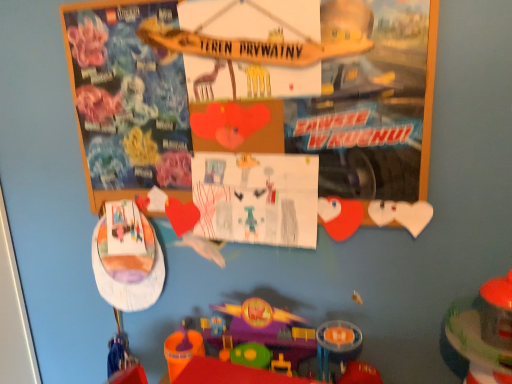
You are a GUI agent. You are given a task and a screenshot of the screen. Output one action in this format:
    pyautogui.click(x=<x>, y=<y>)
    Task: Click on the translucent plastic toy at lower right, which is the first toy in right-to-left order
    
    Given the screenshot: What is the action you would take?
    pyautogui.click(x=484, y=332)

What is the approximate width of colored paper drawing at center?

1.17 inches.

What do you see at coordinates (127, 281) in the screenshot?
I see `matte plastic plate at left, placed as the first toy when sorted from left to right` at bounding box center [127, 281].

Identify the location of wooden sign at upper center. (342, 113).

Locate an element on the screen. The height and width of the screenshot is (384, 512). translucent plastic toy at lower right, which is the first toy in right-to-left order is located at coordinates (484, 332).

From the image's perspective, does colored paper drawing at center appear lower than matte plastic plate at left, placed as the first toy when sorted from left to right?

Incorrect, from the image's perspective, colored paper drawing at center is higher than matte plastic plate at left, placed as the first toy when sorted from left to right.

Locate an element on the screen. poster page above the matte plastic plate at left, the 3th toy positioned from the right (from the image's perspective) is located at coordinates (257, 198).

Is colored paper drawing at center at the left side of matte plastic plate at left, the 3th toy positioned from the right?

No.

From a real-world perspective, who is located higher, colored paper drawing at center or matte plastic plate at left, the 3th toy positioned from the right?

In real-world perspective, colored paper drawing at center is above.

Is wooden sign at upper center situated inside colored paper drawing at center or outside?

wooden sign at upper center is outside colored paper drawing at center.

From a real-world perspective, is wooden sign at upper center above or below colored paper drawing at center?

wooden sign at upper center is situated higher than colored paper drawing at center in the real world.

Is wooden sign at upper center with colored paper drawing at center?

No, wooden sign at upper center is not making contact with colored paper drawing at center.

Considering the relative positions of colored paper drawing at center and translucent plastic toy at lower right, placed as the third toy when sorted from left to right, in the image provided, is colored paper drawing at center to the left of translucent plastic toy at lower right, placed as the third toy when sorted from left to right, from the viewer's perspective?

Yes.

Considering the sizes of colored paper drawing at center and translucent plastic toy at lower right, which is the first toy in right-to-left order, in the image, is colored paper drawing at center bigger or smaller than translucent plastic toy at lower right, which is the first toy in right-to-left order,?

In the image, colored paper drawing at center appears to be smaller than translucent plastic toy at lower right, which is the first toy in right-to-left order.

Is colored paper drawing at center thinner than translucent plastic toy at lower right, placed as the third toy when sorted from left to right?

Correct, the width of colored paper drawing at center is less than that of translucent plastic toy at lower right, placed as the third toy when sorted from left to right.

Identify the location of poster page behind the translucent plastic toy at lower right, placed as the third toy when sorted from left to right. The height and width of the screenshot is (384, 512). (257, 198).

From a real-world perspective, which object rests below the other?

From a 3D spatial view, plastic toy train at center, the 2th toy in the right-to-left sequence, is below.

Is colored paper drawing at center next to plastic toy train at center, the 2th toy in the left-to-right sequence?

No, colored paper drawing at center is not beside plastic toy train at center, the 2th toy in the left-to-right sequence.

Is colored paper drawing at center oriented towards plastic toy train at center, the 2th toy in the left-to-right sequence?

No, colored paper drawing at center is not oriented towards plastic toy train at center, the 2th toy in the left-to-right sequence.

From the image's perspective, between colored paper drawing at center and plastic toy train at center, the 2th toy in the left-to-right sequence, who is located below?

plastic toy train at center, the 2th toy in the left-to-right sequence.

Looking at this image, is wooden sign at upper center facing away from plastic toy train at center, the 2th toy in the left-to-right sequence?

No, wooden sign at upper center is not facing the opposite direction of plastic toy train at center, the 2th toy in the left-to-right sequence.

Is wooden sign at upper center at the left side of plastic toy train at center, the 2th toy in the right-to-left sequence?

Yes.

Does wooden sign at upper center touch plastic toy train at center, the 2th toy in the left-to-right sequence?

wooden sign at upper center and plastic toy train at center, the 2th toy in the left-to-right sequence, are not in contact.

Does point (488, 297) come in front of point (108, 286)?

Yes, it is.

Between translucent plastic toy at lower right, which is the first toy in right-to-left order, and matte plastic plate at left, placed as the first toy when sorted from left to right, which one has less height?

matte plastic plate at left, placed as the first toy when sorted from left to right.

From the image's perspective, is translucent plastic toy at lower right, placed as the third toy when sorted from left to right, located beneath matte plastic plate at left, placed as the first toy when sorted from left to right?

Indeed, from the image's perspective, translucent plastic toy at lower right, placed as the third toy when sorted from left to right, is shown beneath matte plastic plate at left, placed as the first toy when sorted from left to right.

Is matte plastic plate at left, placed as the first toy when sorted from left to right, inside translucent plastic toy at lower right, placed as the third toy when sorted from left to right?

No, matte plastic plate at left, placed as the first toy when sorted from left to right, is located outside of translucent plastic toy at lower right, placed as the third toy when sorted from left to right.

From a real-world perspective, is plastic toy train at center, the 2th toy in the right-to-left sequence, positioned under colored paper drawing at center based on gravity?

Correct, in the physical world, plastic toy train at center, the 2th toy in the right-to-left sequence, is lower than colored paper drawing at center.

Is plastic toy train at center, the 2th toy in the right-to-left sequence, to the right of colored paper drawing at center from the viewer's perspective?

Correct, you'll find plastic toy train at center, the 2th toy in the right-to-left sequence, to the right of colored paper drawing at center.

Is plastic toy train at center, the 2th toy in the right-to-left sequence, far from colored paper drawing at center?

No, there isn't a large distance between plastic toy train at center, the 2th toy in the right-to-left sequence, and colored paper drawing at center.

This screenshot has width=512, height=384. Find the location of `the 3rd toy positioned below the colored paper drawing at center (from a real-world perspective)`. the 3rd toy positioned below the colored paper drawing at center (from a real-world perspective) is located at coordinates (234, 374).

Locate an element on the screen. poster page on the right of matte plastic plate at left, placed as the first toy when sorted from left to right is located at coordinates (257, 198).

The width and height of the screenshot is (512, 384). Find the location of `bulletin board positioned vertically above the colored paper drawing at center (from a real-world perspective)`. bulletin board positioned vertically above the colored paper drawing at center (from a real-world perspective) is located at coordinates (342, 113).

Estimate the real-world distances between objects in this image. Which object is further from matte plastic plate at left, placed as the first toy when sorted from left to right, colored paper drawing at center or plastic toy train at center, the 2th toy in the left-to-right sequence?

The object further to matte plastic plate at left, placed as the first toy when sorted from left to right, is plastic toy train at center, the 2th toy in the left-to-right sequence.

Considering their positions, is plastic toy train at center, the 2th toy in the left-to-right sequence, positioned further to matte plastic plate at left, placed as the first toy when sorted from left to right, than wooden sign at upper center?

Based on the image, wooden sign at upper center appears to be further to matte plastic plate at left, placed as the first toy when sorted from left to right.

Based on the photo, looking at the image, which one is located further to colored paper drawing at center, translucent plastic toy at lower right, placed as the third toy when sorted from left to right, or wooden sign at upper center?

The object further to colored paper drawing at center is translucent plastic toy at lower right, placed as the third toy when sorted from left to right.

Looking at the image, which one is located closer to wooden sign at upper center, matte plastic plate at left, the 3th toy positioned from the right, or colored paper drawing at center?

Among the two, colored paper drawing at center is located nearer to wooden sign at upper center.

Looking at the image, which one is located further to colored paper drawing at center, wooden sign at upper center or plastic toy train at center, the 2th toy in the right-to-left sequence?

Among the two, plastic toy train at center, the 2th toy in the right-to-left sequence, is located further to colored paper drawing at center.

When comparing their distances from translucent plastic toy at lower right, which is the first toy in right-to-left order, does matte plastic plate at left, placed as the first toy when sorted from left to right, or plastic toy train at center, the 2th toy in the left-to-right sequence, seem further?

matte plastic plate at left, placed as the first toy when sorted from left to right.

From the image, which object appears to be farther from matte plastic plate at left, placed as the first toy when sorted from left to right, translucent plastic toy at lower right, placed as the third toy when sorted from left to right, or plastic toy train at center, the 2th toy in the left-to-right sequence?

Among the two, translucent plastic toy at lower right, placed as the third toy when sorted from left to right, is located further to matte plastic plate at left, placed as the first toy when sorted from left to right.

Based on their spatial positions, is matte plastic plate at left, placed as the first toy when sorted from left to right, or translucent plastic toy at lower right, placed as the third toy when sorted from left to right, further from plastic toy train at center, the 2th toy in the left-to-right sequence?

Among the two, translucent plastic toy at lower right, placed as the third toy when sorted from left to right, is located further to plastic toy train at center, the 2th toy in the left-to-right sequence.

Locate an element on the screen. Image resolution: width=512 pixels, height=384 pixels. poster page between wooden sign at upper center and translucent plastic toy at lower right, placed as the third toy when sorted from left to right, from left to right is located at coordinates (257, 198).

Where is `poster page between wooden sign at upper center and plastic toy train at center, the 2th toy in the left-to-right sequence, in the up-down direction`? The height and width of the screenshot is (384, 512). poster page between wooden sign at upper center and plastic toy train at center, the 2th toy in the left-to-right sequence, in the up-down direction is located at coordinates point(257,198).

The height and width of the screenshot is (384, 512). In order to click on poster page situated between matte plastic plate at left, the 3th toy positioned from the right, and translucent plastic toy at lower right, placed as the third toy when sorted from left to right, from left to right in this screenshot , I will do `click(257, 198)`.

The width and height of the screenshot is (512, 384). What are the coordinates of `toy located between matte plastic plate at left, the 3th toy positioned from the right, and translucent plastic toy at lower right, which is the first toy in right-to-left order, in the left-right direction` in the screenshot? It's located at (234, 374).